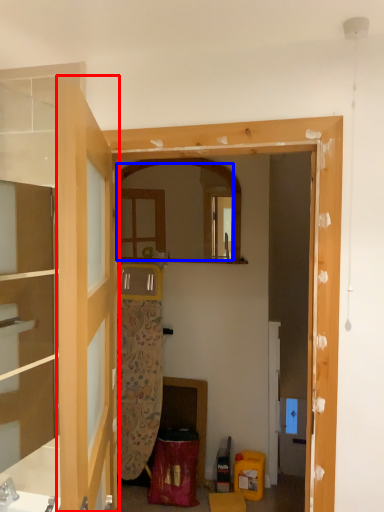
Question: Which of the following is the closest to the observer, door (highlighted by a red box) or mirror (highlighted by a blue box)?

Choices:
 (A) door
 (B) mirror

Answer: (A)